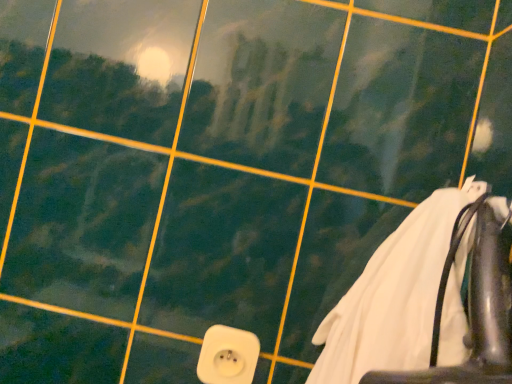
What do you see at coordinates (393, 296) in the screenshot?
I see `white fabric at lower right` at bounding box center [393, 296].

Find the location of a particular element. The image size is (512, 384). white fabric at lower right is located at coordinates (393, 296).

The width and height of the screenshot is (512, 384). Identify the location of white fabric at lower right. (393, 296).